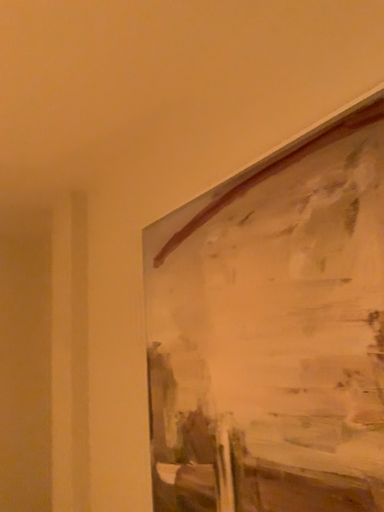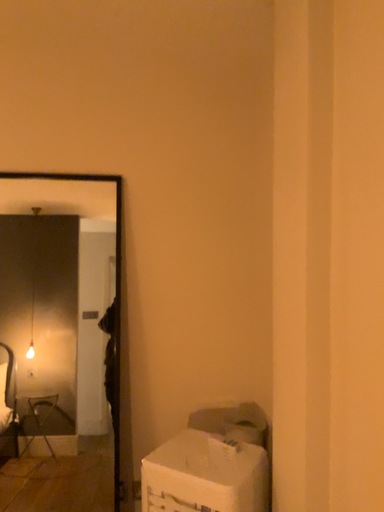
Question: Which way did the camera rotate in the video?

Choices:
 (A) rotated downward
 (B) rotated upward

Answer: (A)